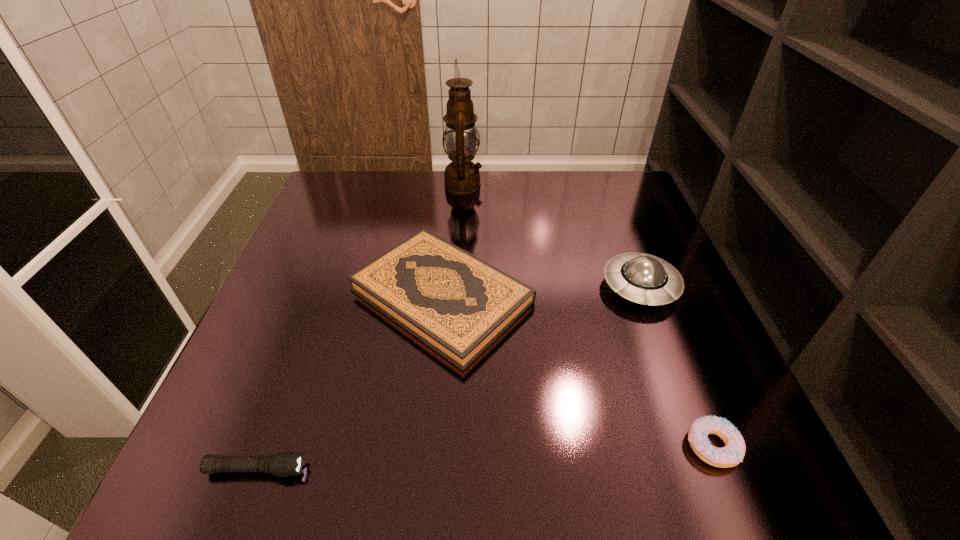
The image size is (960, 540). In order to click on the farthest object in this screenshot , I will do `click(462, 176)`.

I want to click on the tallest object, so click(x=462, y=176).

Where is `the second tallest object`? the second tallest object is located at coordinates click(x=642, y=278).

I want to click on hardback book, so click(x=457, y=304).

This screenshot has height=540, width=960. In order to click on doughnut in this screenshot , I will do `click(732, 454)`.

The height and width of the screenshot is (540, 960). Find the location of `flashlight`. flashlight is located at coordinates (284, 464).

At what (x,y) coordinates should I click in order to perform the action: click on vacant space located on the front of the oil lamp. Please return your answer as a coordinate pair (x, y). This screenshot has width=960, height=540. Looking at the image, I should click on (461, 234).

You are a GUI agent. You are given a task and a screenshot of the screen. Output one action in this format:
    pyautogui.click(x=<x>, y=<y>)
    Task: Click on the free region located on the front of the second tallest object
    
    Given the screenshot: What is the action you would take?
    pyautogui.click(x=705, y=455)

I want to click on vacant region located 0.070m on the right of the hardback book, so click(566, 296).

This screenshot has height=540, width=960. Find the location of `vacant space situated on the left of the doughnut`. vacant space situated on the left of the doughnut is located at coordinates (543, 446).